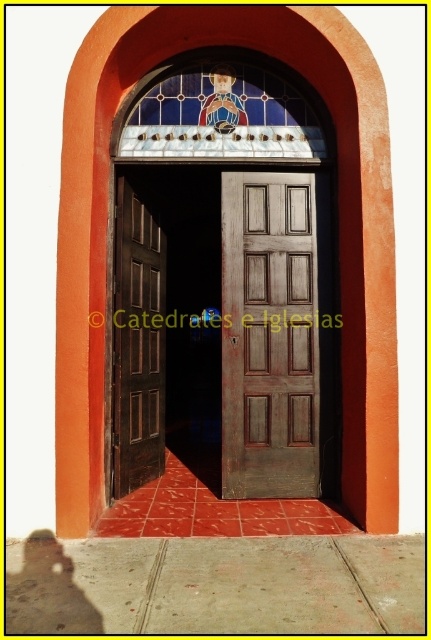
Is wooden door at center shorter than wooden panel door at center?

In fact, wooden door at center may be taller than wooden panel door at center.

I want to click on wooden door at center, so click(221, 324).

Does point (127, 461) come farther from viewer compared to point (278, 269)?

Yes, point (127, 461) is farther from viewer.

The height and width of the screenshot is (640, 431). What are the coordinates of `wooden door at center` in the screenshot? It's located at (221, 324).

Does wooden door at center appear on the left side of brown wooden door at left?

No, wooden door at center is not to the left of brown wooden door at left.

Does point (293, 323) come behind point (144, 435)?

No, (293, 323) is in front of (144, 435).

Does point (280, 387) lie in front of point (127, 458)?

Yes, it is.

The width and height of the screenshot is (431, 640). Find the location of `wooden door at center`. wooden door at center is located at coordinates (221, 324).

Does wooden panel door at center appear on the right side of brown wooden door at left?

Indeed, wooden panel door at center is positioned on the right side of brown wooden door at left.

Between point (308, 492) and point (155, 422), which one is positioned in front?

Point (308, 492) is in front.

The width and height of the screenshot is (431, 640). I want to click on wooden panel door at center, so click(x=269, y=336).